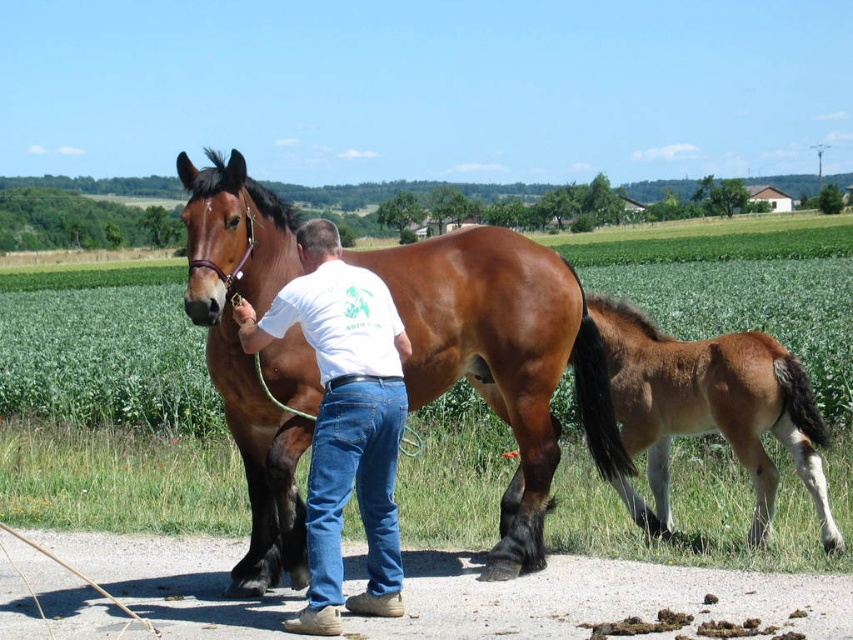
Can you confirm if white cotton shirt at center is positioned to the right of brown glossy foal at lower right?

No, white cotton shirt at center is not to the right of brown glossy foal at lower right.

Does white cotton shirt at center have a greater height compared to brown glossy foal at lower right?

Indeed, white cotton shirt at center has a greater height compared to brown glossy foal at lower right.

Between point (364, 314) and point (764, 340), which one is positioned in front?

Point (364, 314)

At what (x,y) coordinates should I click in order to perform the action: click on white cotton shirt at center. Please return your answer as a coordinate pair (x, y). The width and height of the screenshot is (853, 640). Looking at the image, I should click on (344, 419).

Who is more distant from viewer, (509, 282) or (347, 353)?

The point (509, 282) is more distant.

Which is behind, point (231, 177) or point (300, 236)?

Point (300, 236)

Locate an element on the screen. The image size is (853, 640). brown glossy horse at center is located at coordinates (506, 362).

Is brown glossy horse at center shorter than brown glossy foal at lower right?

Yes, brown glossy horse at center is shorter than brown glossy foal at lower right.

Is point (521, 467) positioned after point (778, 429)?

No.

Locate an element on the screen. brown glossy horse at center is located at coordinates (506, 362).